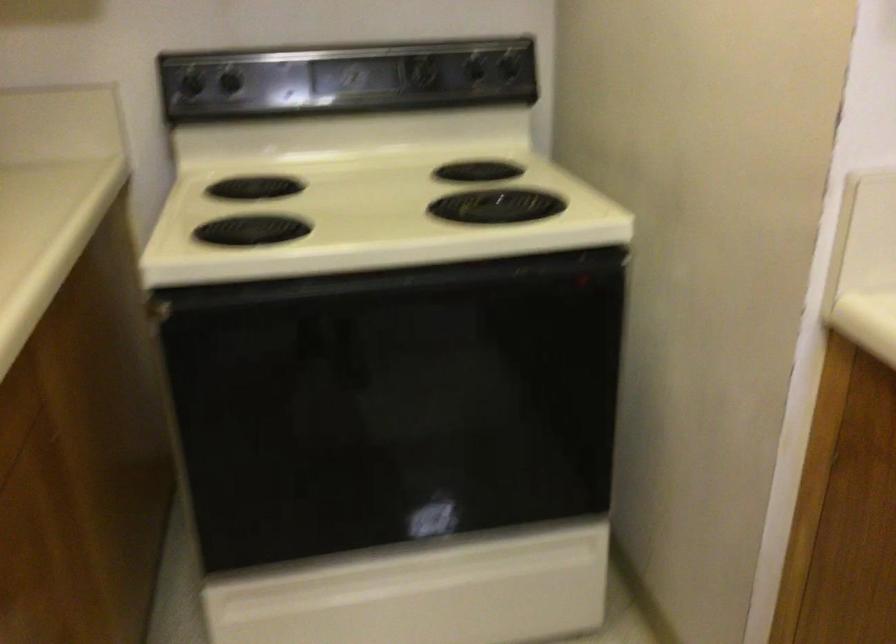
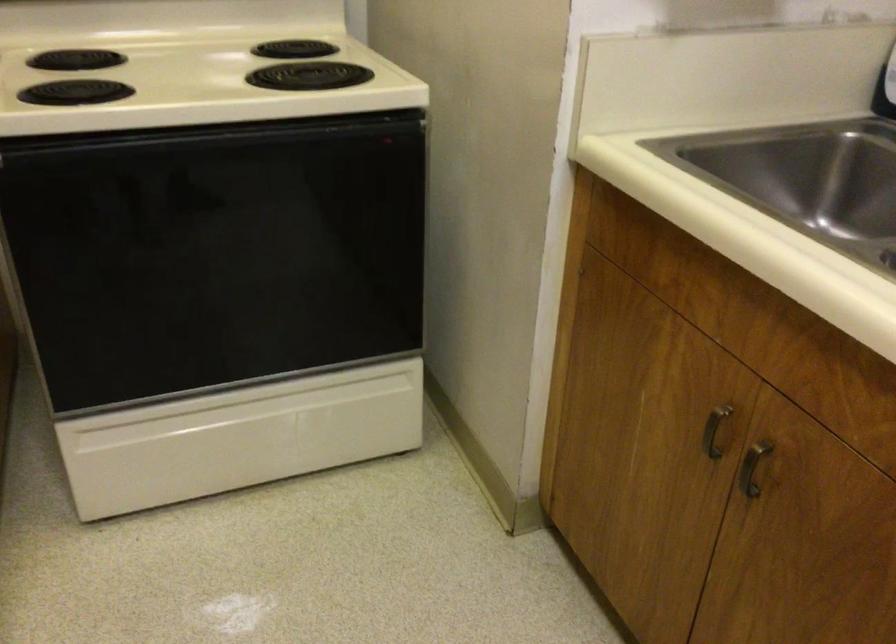
Locate, in the second image, the point that corresponds to point (391, 278) in the first image.

(213, 136)